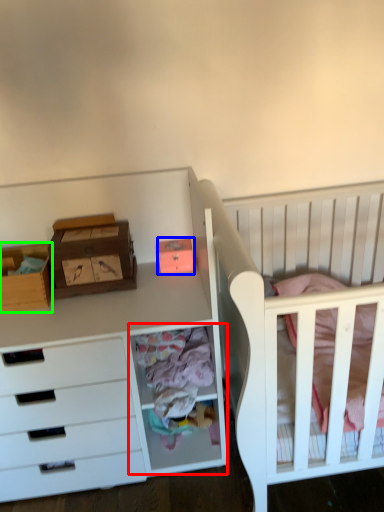
Question: Estimate the real-world distances between objects in this image. Which object is closer to cabinet (highlighted by a red box), storage box (highlighted by a blue box) or storage box (highlighted by a green box)?

Choices:
 (A) storage box
 (B) storage box

Answer: (A)